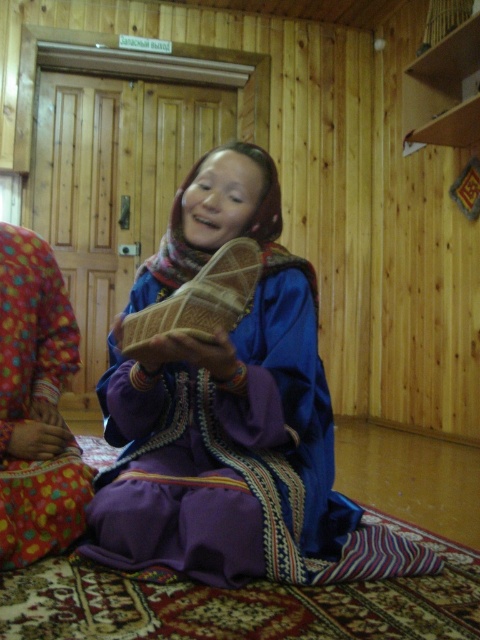
Looking at this image, you are a delivery robot with a 12 inch wide package. You need to place the package between the matte brown sandal at center and the purple satin dress at center. Is there enough space for the package?

The matte brown sandal at center is 11.63 inches away from the purple satin dress at center. Since the package is 12 inches wide, there is not enough space to place it between them.

You are a delivery person who needs to place a small package between the matte brown sandal at center and the purple satin dress at center. Can you fit it there if the package is 10 cm wide?

The matte brown sandal at center might be wider than the purple satin dress at center, so the space between them may not be sufficient for a 10 cm wide package. Check the actual width before placing the package.